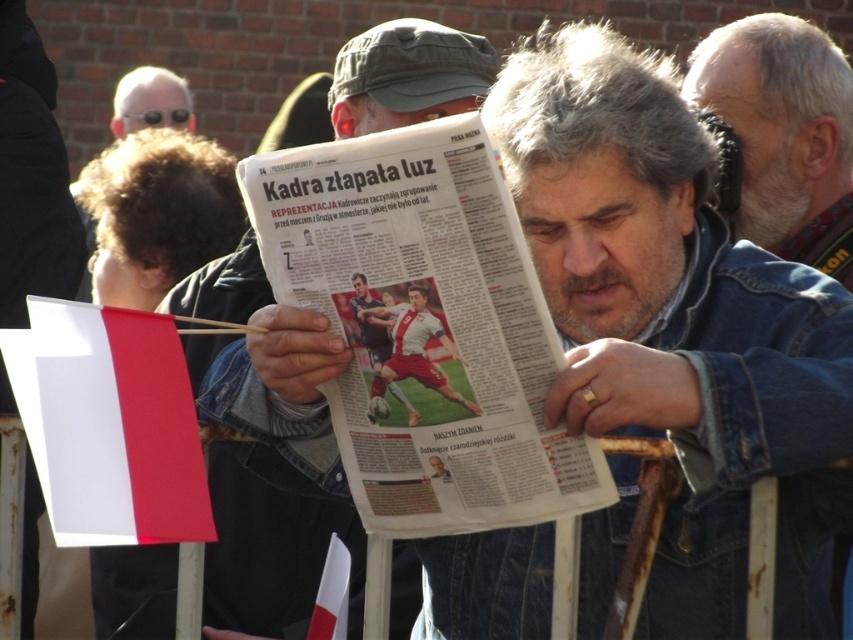
Between point (155, 365) and point (143, 118), which one is positioned in front?

Positioned in front is point (155, 365).

This screenshot has height=640, width=853. What do you see at coordinates (109, 422) in the screenshot?
I see `white paper flag at lower left` at bounding box center [109, 422].

Does point (91, 392) lie in front of point (171, 124)?

Yes, point (91, 392) is in front of point (171, 124).

What are the coordinates of `white paper flag at lower left` in the screenshot? It's located at (109, 422).

Can you confirm if matte newspaper at center is wider than gray hair at upper right?

Yes.

Between point (167, 304) and point (744, 92), which one is positioned in front?

Point (744, 92) is more forward.

Where is `matte newspaper at center`? matte newspaper at center is located at coordinates (258, 349).

Between matte black sunglasses at upper left and white paper flag at lower center, which one appears on the left side from the viewer's perspective?

matte black sunglasses at upper left is more to the left.

Does matte black sunglasses at upper left have a larger size compared to white paper flag at lower center?

Correct, matte black sunglasses at upper left is larger in size than white paper flag at lower center.

Is point (190, 122) positioned before point (325, 577)?

That is False.

Find the location of a particular element. This screenshot has width=853, height=640. matte black sunglasses at upper left is located at coordinates (149, 100).